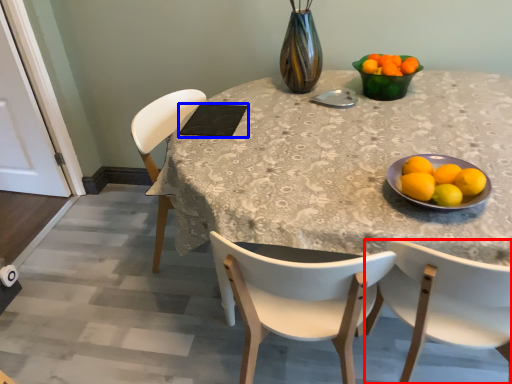
Question: Which of the following is the closest to the observer, chair (highlighted by a red box) or pad (highlighted by a blue box)?

Choices:
 (A) chair
 (B) pad

Answer: (A)